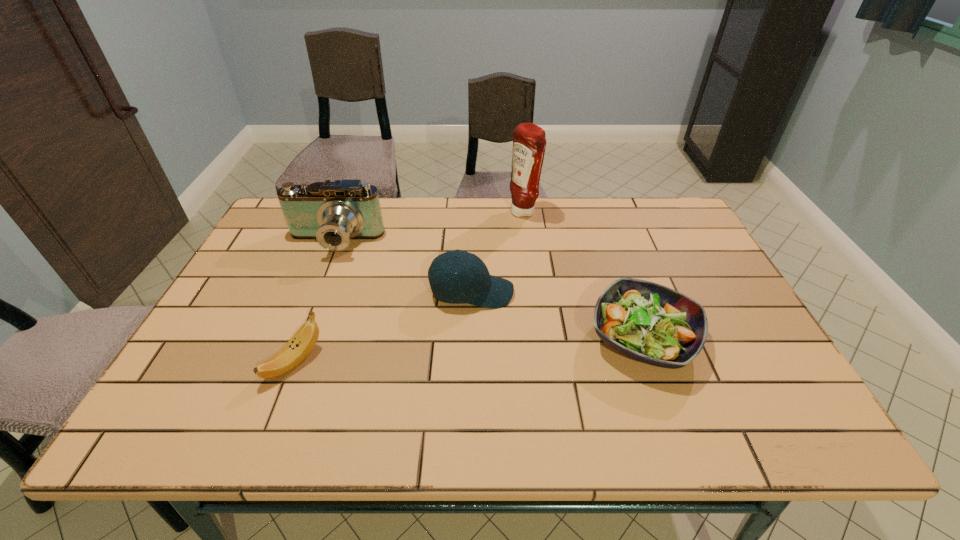
Locate which object ranks in proximity to the camcorder. Please provide its 2D coordinates. Your answer should be formatted as a tuple, i.e. [(x, y)], where the tuple contains the x and y coordinates of a point satisfying the conditions above.

[(473, 284)]

Select which object appears as the closest to the salad plate. Please provide its 2D coordinates. Your answer should be formatted as a tuple, i.e. [(x, y)], where the tuple contains the x and y coordinates of a point satisfying the conditions above.

[(473, 284)]

Find the location of a particular element. vacant region that satisfies the following two spatial constraints: 1. on the front-facing side of the camcorder; 2. on the right side of the salad plate is located at coordinates (296, 338).

In order to click on vacant space that satisfies the following two spatial constraints: 1. on the back side of the salad plate; 2. on the front-facing side of the third tallest object in this screenshot , I will do `click(627, 293)`.

Locate an element on the screen. The width and height of the screenshot is (960, 540). free region that satisfies the following two spatial constraints: 1. on the front-facing side of the third tallest object; 2. on the right side of the salad plate is located at coordinates (470, 338).

Locate an element on the screen. Image resolution: width=960 pixels, height=540 pixels. blank space that satisfies the following two spatial constraints: 1. on the front-facing side of the third shortest object; 2. on the front side of the banana is located at coordinates (470, 362).

Locate an element on the screen. The width and height of the screenshot is (960, 540). blank area in the image that satisfies the following two spatial constraints: 1. on the front-facing side of the camcorder; 2. on the right side of the banana is located at coordinates (286, 362).

Identify the location of vacant point that satisfies the following two spatial constraints: 1. on the front-facing side of the fourth shortest object; 2. on the right side of the salad plate. The height and width of the screenshot is (540, 960). (296, 338).

This screenshot has width=960, height=540. Identify the location of free space that satisfies the following two spatial constraints: 1. on the front-facing side of the fourth shortest object; 2. on the right side of the banana. (286, 362).

Locate an element on the screen. This screenshot has width=960, height=540. vacant space that satisfies the following two spatial constraints: 1. on the front-facing side of the rightmost object; 2. on the left side of the camcorder is located at coordinates (296, 338).